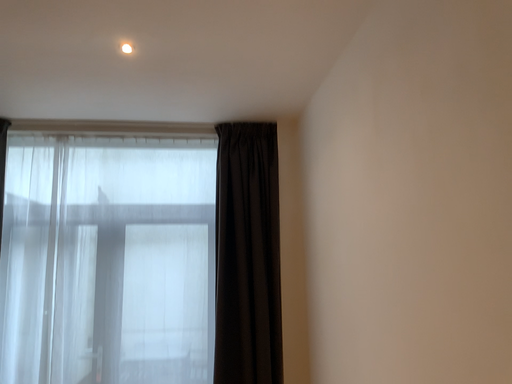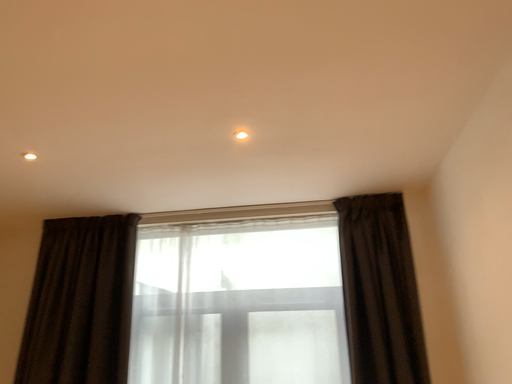
Question: How did the camera likely rotate when shooting the video?

Choices:
 (A) rotated right
 (B) rotated left

Answer: (B)